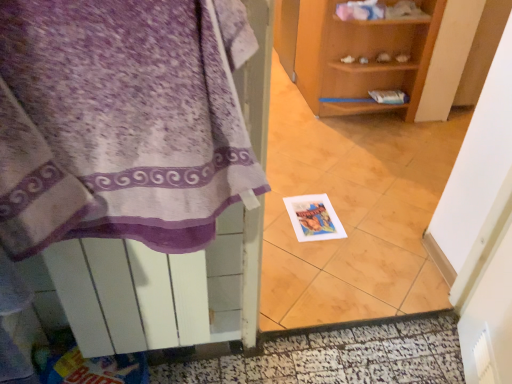
Identify the location of free space above white paper postcard at center (from a real-world perspective). (318, 213).